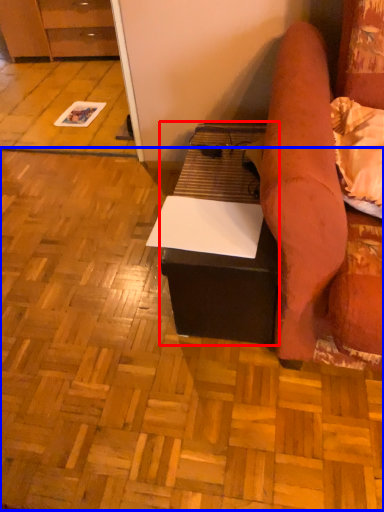
Question: Which object appears farthest to the camera in this image, table (highlighted by a red box) or plywood (highlighted by a blue box)?

Choices:
 (A) table
 (B) plywood

Answer: (A)